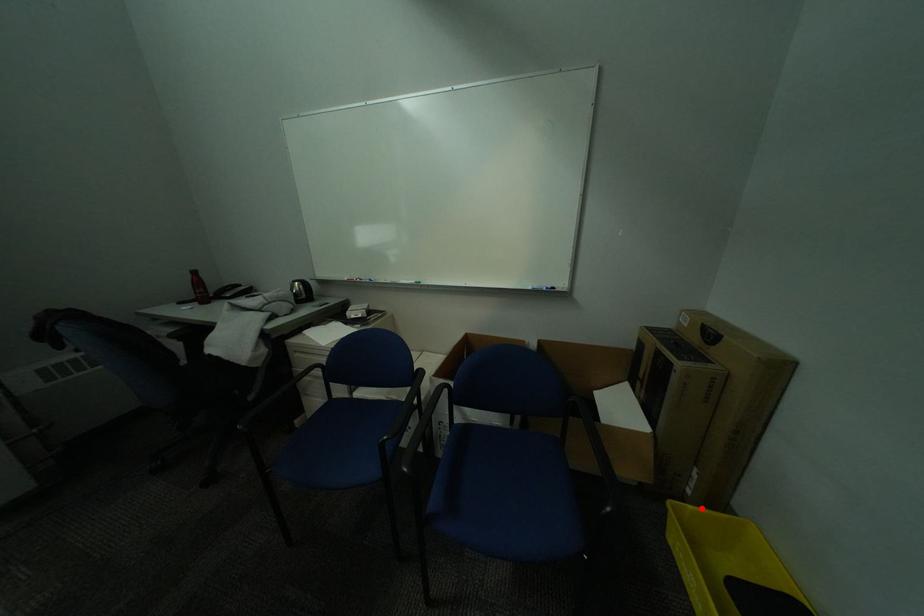
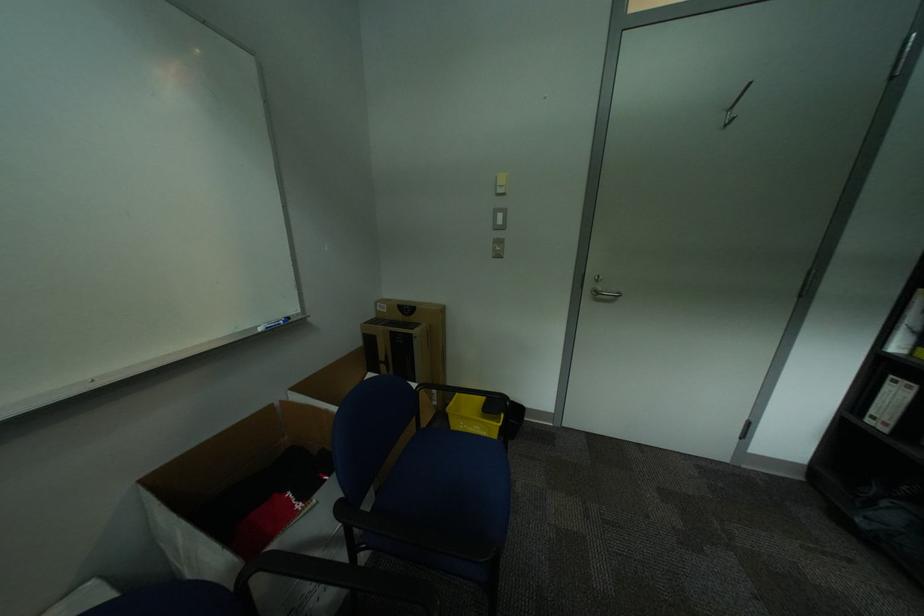
Locate, in the second image, the point that corresponds to the highlighted location in the first image.

(463, 405)